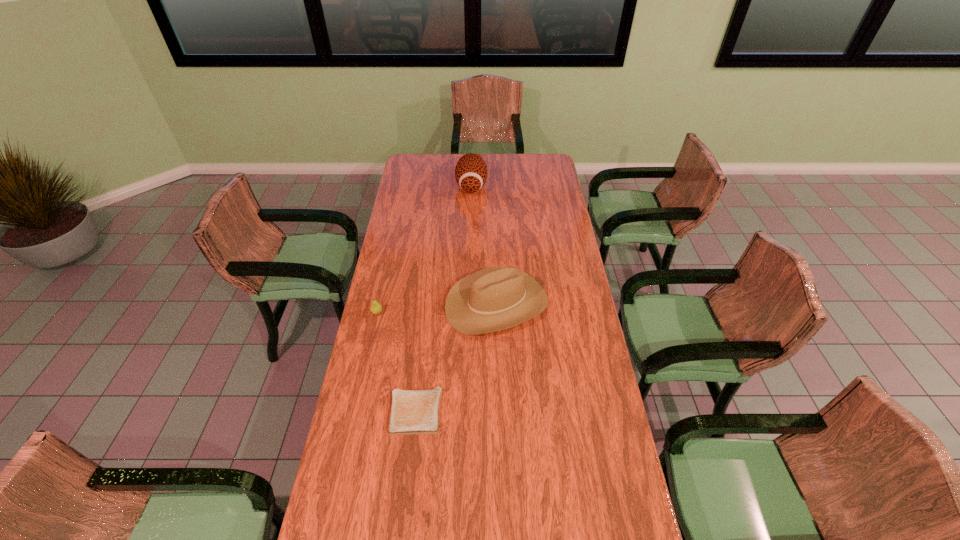
Image resolution: width=960 pixels, height=540 pixels. Identify the location of the farthest object. (471, 171).

Find the location of `cowboy hat`. cowboy hat is located at coordinates (x=496, y=298).

In order to click on the second shortest object in this screenshot , I will do `click(376, 308)`.

This screenshot has height=540, width=960. Identify the location of pear. (376, 308).

Locate an element on the screen. the nearest object is located at coordinates (412, 411).

Locate an element on the screen. The height and width of the screenshot is (540, 960). toast is located at coordinates (412, 411).

Where is `vacant area situated 0.230m on the left of the farthest object`? The width and height of the screenshot is (960, 540). vacant area situated 0.230m on the left of the farthest object is located at coordinates (413, 186).

This screenshot has height=540, width=960. I want to click on free space located on the left of the cowboy hat, so click(430, 304).

The width and height of the screenshot is (960, 540). Identify the location of vacant space situated on the front of the third tallest object. (356, 411).

Where is `vacant area located on the back of the nearest object`? The image size is (960, 540). vacant area located on the back of the nearest object is located at coordinates [427, 307].